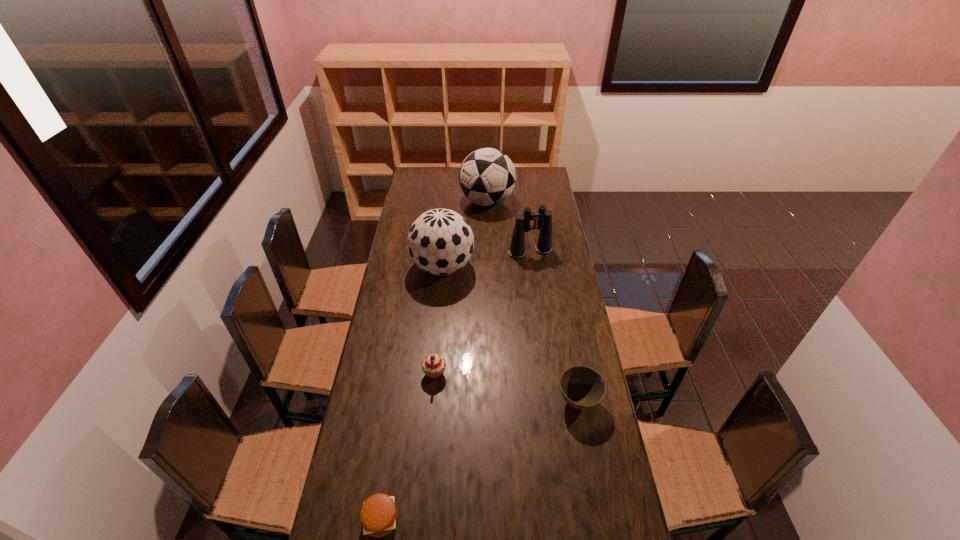
What are the coordinates of `vacant space located 0.050m on the back of the nearer soccer ball` in the screenshot? It's located at (445, 241).

This screenshot has width=960, height=540. I want to click on free space located on the back of the binoculars, so click(x=528, y=232).

The height and width of the screenshot is (540, 960). Identify the location of free space located 0.330m on the back of the cupcake. (442, 300).

Where is `free point located 0.120m on the left of the bowl`? The image size is (960, 540). free point located 0.120m on the left of the bowl is located at coordinates (521, 401).

The image size is (960, 540). Identify the location of free space located 0.080m on the back of the shortest object. (388, 473).

This screenshot has height=540, width=960. Identify the location of object at the far edge. (487, 176).

At what (x,y) coordinates should I click in order to perform the action: click on soccer ball positioned at the left edge. Please return your answer as a coordinate pair (x, y). Looking at the image, I should click on (440, 241).

You are a GUI agent. You are given a task and a screenshot of the screen. Output one action in this format:
    pyautogui.click(x=<x>, y=<y>)
    Task: Click on the hamburger at the left edge
    The height and width of the screenshot is (540, 960).
    Given the screenshot: What is the action you would take?
    pyautogui.click(x=378, y=514)

Locate an element on the screen. The height and width of the screenshot is (540, 960). binoculars that is at the right edge is located at coordinates (544, 217).

Identify the location of bowl located at the right edge. (582, 387).